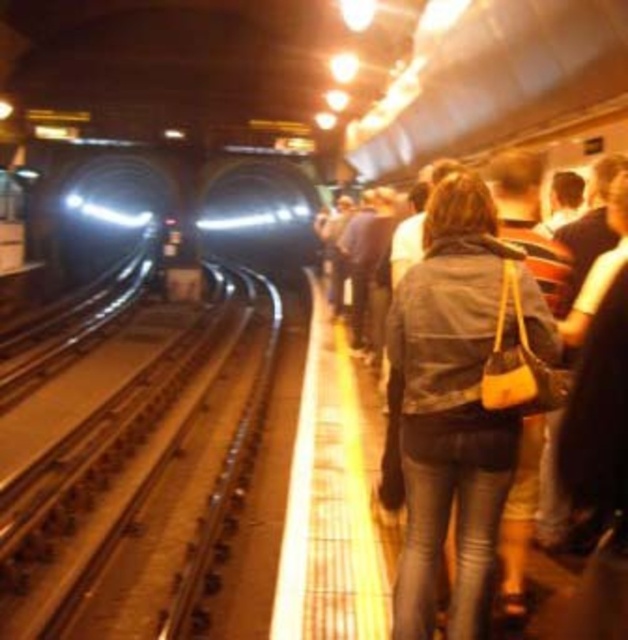
You are standing at the point labeled point (143, 483) on the subway platform. Based on the scene description, what object is directly under your feet?

The point labeled point (143, 483) corresponds to the metallic smooth train track at center, so the object directly under your feet is the metallic smooth train track at center.

You are a passenger waiting for the train on the subway platform. You see the metallic smooth train track at center and the leather jacket at center. Which object is closer to the ground?

The metallic smooth train track at center is located below the leather jacket at center, so it is closer to the ground.

You are standing on the subway platform and want to determine which of the two points, point (104,403) or point (472,236), is closer to you. Which point is closer?

Point (104,403) is closer to you because it is further to the viewer than point (472,236).